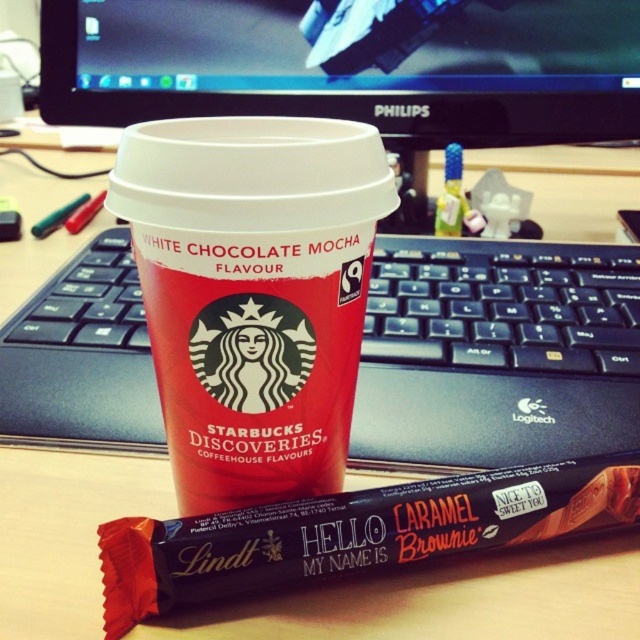
Question: Which object is the farthest from the black plastic keyboard at center?

Choices:
 (A) black glossy monitor at upper center
 (B) red matte paper cup at center
 (C) dark chocolate bar at center

Answer: (A)

Question: Can you confirm if red matte paper cup at center is bigger than black glossy monitor at upper center?

Choices:
 (A) no
 (B) yes

Answer: (A)

Question: Does black plastic keyboard at center have a lesser width compared to red matte paper cup at center?

Choices:
 (A) yes
 (B) no

Answer: (B)

Question: Which point is farther from the camera taking this photo?

Choices:
 (A) 477,54
 (B) 472,497
 (C) 156,417
 (D) 243,189

Answer: (A)

Question: Does black plastic keyboard at center have a smaller size compared to dark chocolate bar at center?

Choices:
 (A) no
 (B) yes

Answer: (A)

Question: Which object is the farthest from the black plastic keyboard at center?

Choices:
 (A) black glossy monitor at upper center
 (B) dark chocolate bar at center
 (C) red matte paper cup at center

Answer: (A)